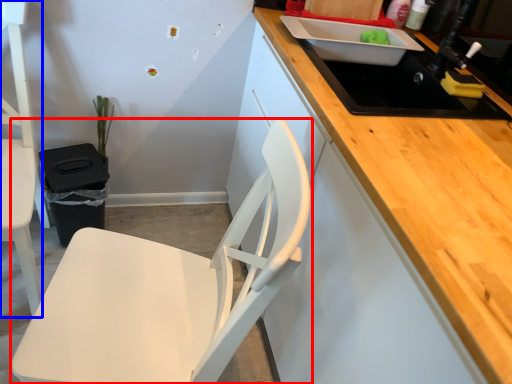
Question: Among these objects, which one is farthest to the camera, chair (highlighted by a red box) or chair (highlighted by a blue box)?

Choices:
 (A) chair
 (B) chair

Answer: (B)